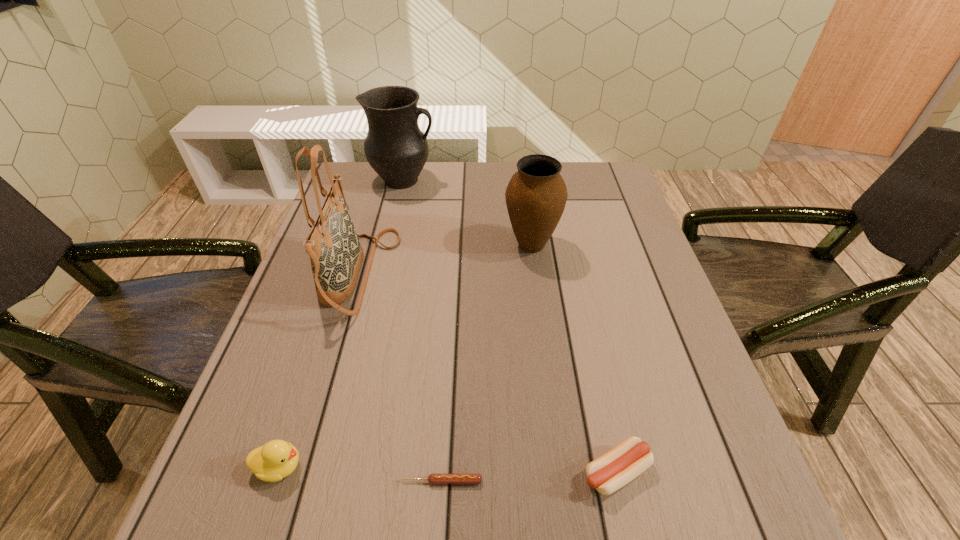
The height and width of the screenshot is (540, 960). In order to click on the tallest object in this screenshot , I will do `click(336, 255)`.

You are a GUI agent. You are given a task and a screenshot of the screen. Output one action in this format:
    pyautogui.click(x=<x>, y=<y>)
    Task: Click on the farthest object
    The image size is (960, 540).
    Given the screenshot: What is the action you would take?
    pyautogui.click(x=395, y=147)

Find the location of a particular element. The height and width of the screenshot is (540, 960). urn is located at coordinates (536, 195).

Find the location of a particular element. The width and height of the screenshot is (960, 540). duckling is located at coordinates (277, 459).

This screenshot has width=960, height=540. Find the location of `the second shortest object`. the second shortest object is located at coordinates (616, 468).

Find the location of a particular element. the taller sausage is located at coordinates (616, 468).

Locate an element on the screen. The height and width of the screenshot is (540, 960). the shorter sausage is located at coordinates (435, 479).

Identify the location of the left sausage. This screenshot has height=540, width=960. (435, 479).

This screenshot has width=960, height=540. What are the coordinates of `free space located 0.170m on the front-facing side of the tallest object` in the screenshot? It's located at (464, 274).

Find the location of a particular element. Image resolution: width=960 pixels, height=540 pixels. vacant area situated on the handle side of the farthest object is located at coordinates (545, 180).